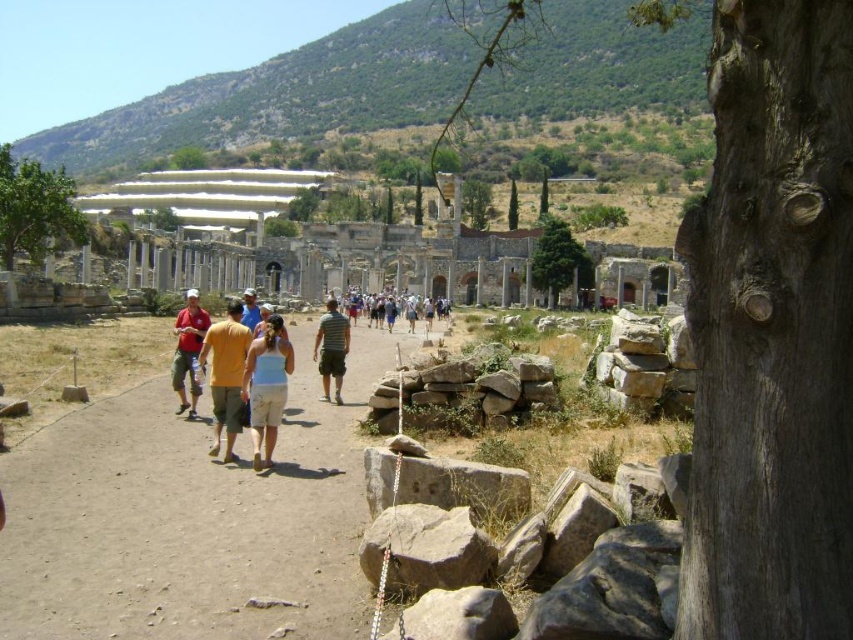
Based on the photo, which is above, brown dirt path at center or matte red shirt at center?

matte red shirt at center

Does point (90, 538) lie in front of point (194, 336)?

Yes, it is.

Find the location of a particular element. This screenshot has height=640, width=853. brown dirt path at center is located at coordinates (190, 518).

Can you confirm if light blue cotton tank top at center is positioned below yellow cotton shirt at center?

Correct, light blue cotton tank top at center is located below yellow cotton shirt at center.

Is light blue cotton tank top at center thinner than yellow cotton shirt at center?

Yes.

Is point (244, 364) positioned before point (212, 444)?

No, (244, 364) is behind (212, 444).

Where is `light blue cotton tank top at center`? Image resolution: width=853 pixels, height=640 pixels. light blue cotton tank top at center is located at coordinates (265, 387).

Is light blue cotton tank top at center taller than light blue t-shirt at center?

Correct, light blue cotton tank top at center is much taller as light blue t-shirt at center.

What do you see at coordinates (265, 387) in the screenshot? The width and height of the screenshot is (853, 640). I see `light blue cotton tank top at center` at bounding box center [265, 387].

Where is `light blue cotton tank top at center`? The image size is (853, 640). light blue cotton tank top at center is located at coordinates (265, 387).